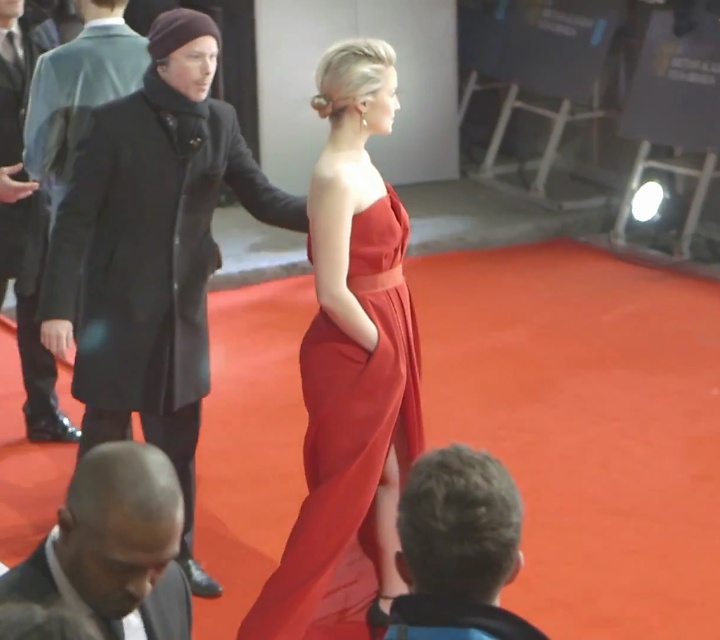
Based on the photo, between smooth blue jacket at center and matte black coat at center, which one appears on the left side from the viewer's perspective?

Positioned to the left is matte black coat at center.

Is point (415, 531) positioned after point (40, 385)?

No, (415, 531) is closer to viewer.

Locate an element on the screen. This screenshot has height=640, width=720. smooth blue jacket at center is located at coordinates (458, 547).

Which is in front, point (114, 524) or point (66, 166)?

Point (114, 524)

From the picture: Does shiny black suit at lower left have a greater height compared to black wool coat at left?

In fact, shiny black suit at lower left may be shorter than black wool coat at left.

Where is `shiny black suit at lower left`? shiny black suit at lower left is located at coordinates (114, 545).

Can you confirm if black wool coat at center is taller than satin red dress at center?

Indeed, black wool coat at center has a greater height compared to satin red dress at center.

Can you confirm if black wool coat at center is shorter than satin red dress at center?

Incorrect, black wool coat at center's height does not fall short of satin red dress at center's.

Between point (189, 536) and point (328, 625), which one is positioned in front?

Positioned in front is point (328, 625).

Where is `black wool coat at center`? black wool coat at center is located at coordinates (152, 252).